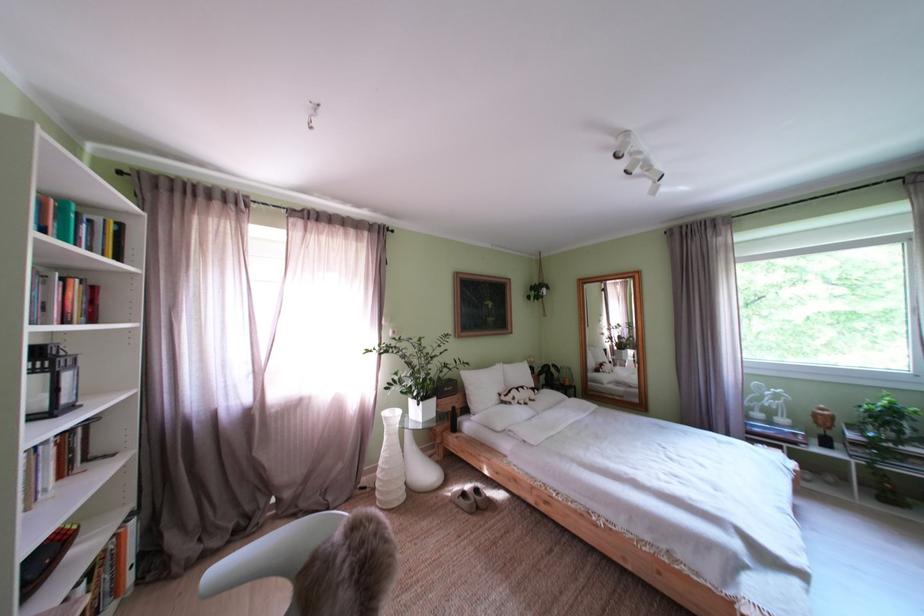
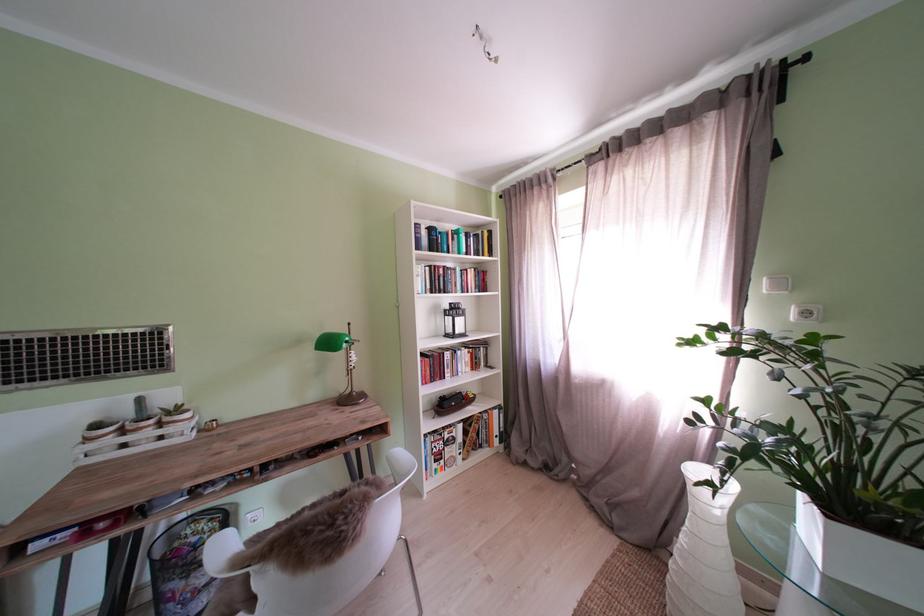
Where in the second image is the point corresponding to [359,222] from the first image?

(681, 116)